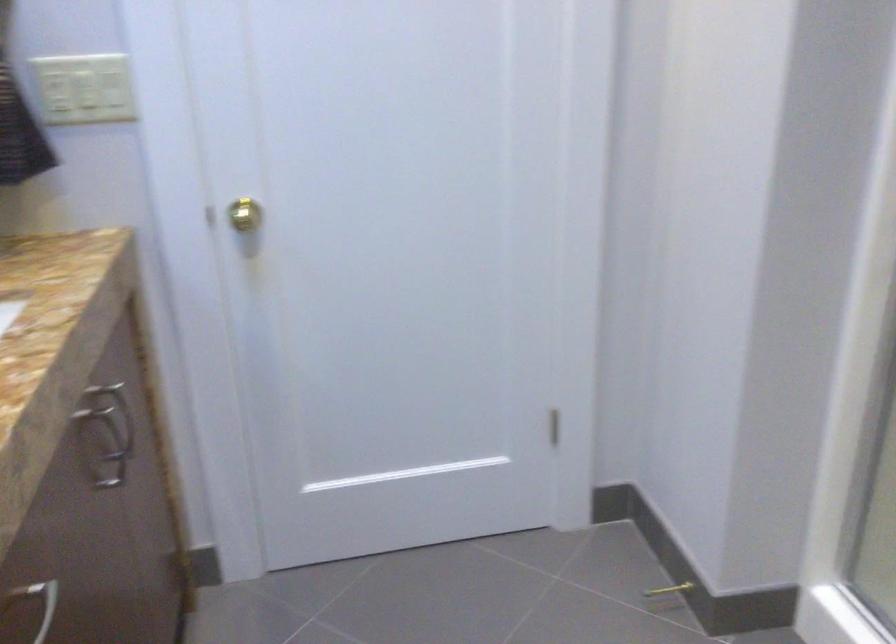
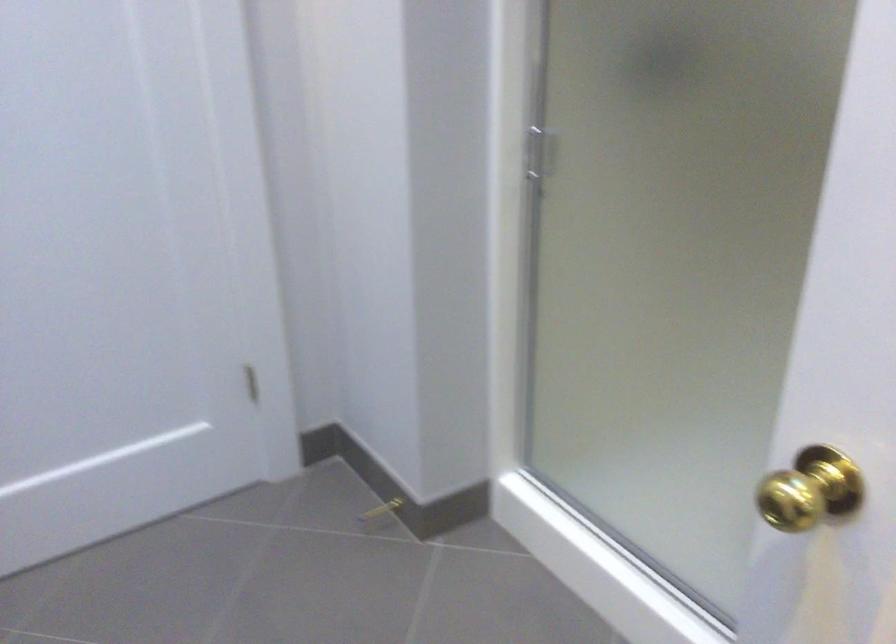
In a continuous first-person perspective shot, in which direction is the camera moving?

The movement direction of the cameraman is left, backward.